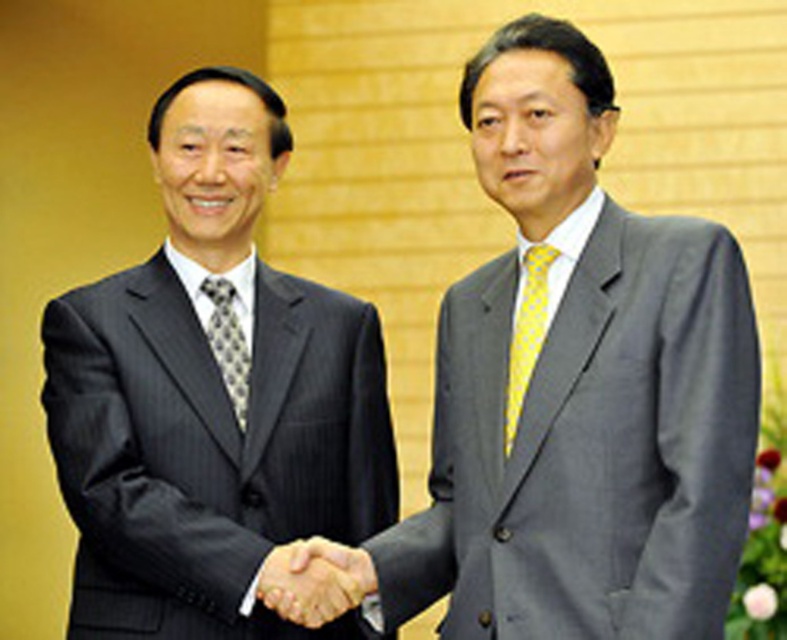
Question: Can you confirm if yellow dotted tie at right is bigger than gray patterned tie at left?

Choices:
 (A) no
 (B) yes

Answer: (B)

Question: Is matte black suit at left to the left of gray patterned tie at left from the viewer's perspective?

Choices:
 (A) yes
 (B) no

Answer: (B)

Question: Which point appears farthest from the camera in this image?

Choices:
 (A) (126, 316)
 (B) (353, 600)
 (C) (512, 397)

Answer: (A)

Question: Can you confirm if smooth skin handshake at center is thinner than yellow dotted tie at right?

Choices:
 (A) yes
 (B) no

Answer: (B)

Question: Considering the real-world distances, which object is farthest from the gray patterned tie at left?

Choices:
 (A) smooth skin handshake at center
 (B) yellow dotted tie at right
 (C) matte black suit at left

Answer: (B)

Question: Based on their relative distances, which object is farther from the smooth skin handshake at center?

Choices:
 (A) gray patterned tie at left
 (B) matte black suit at left
 (C) yellow dotted tie at right
 (D) matte gray suit at center

Answer: (C)